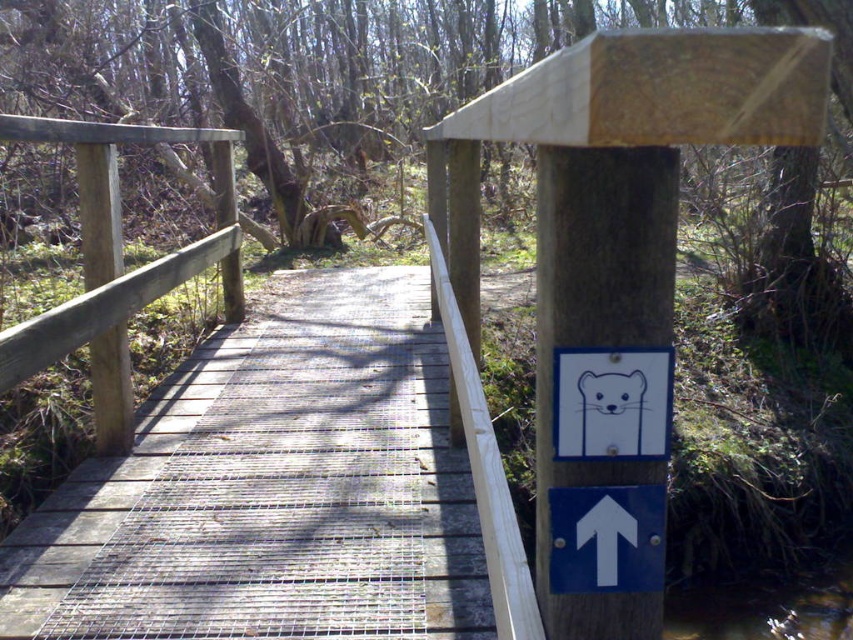
Question: Among these points, which one is farthest from the camera?

Choices:
 (A) (558, 449)
 (B) (405, 326)

Answer: (B)

Question: Does wooden bridge at center come behind white plastic sign at upper right?

Choices:
 (A) yes
 (B) no

Answer: (A)

Question: From the image, what is the correct spatial relationship of white plastic sign at upper right in relation to white plastic arrow at upper center?

Choices:
 (A) above
 (B) below

Answer: (A)

Question: Does natural wood signpost at upper center have a greater width compared to white plastic arrow at upper center?

Choices:
 (A) no
 (B) yes

Answer: (B)

Question: Which object is positioned farthest from the white plastic sign at upper right?

Choices:
 (A) wooden bridge at center
 (B) natural wood signpost at upper center

Answer: (A)

Question: Which object appears farthest from the camera in this image?

Choices:
 (A) wooden bridge at center
 (B) white plastic sign at upper right
 (C) natural wood signpost at upper center

Answer: (A)